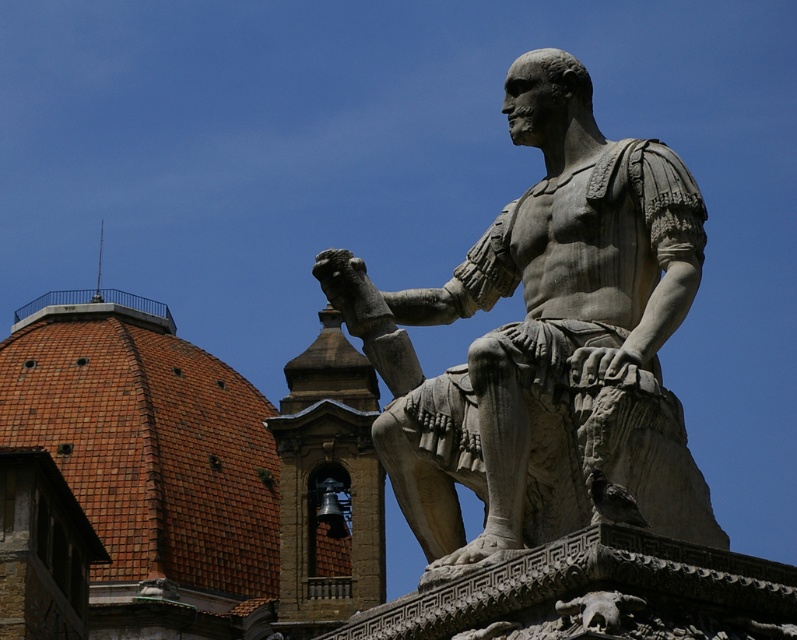
Consider the image. Can you confirm if gray stone statue at center is thinner than bronze bell at center?

No, gray stone statue at center is not thinner than bronze bell at center.

Which of these two, gray stone statue at center or bronze bell at center, stands shorter?

gray stone statue at center

Where is `gray stone statue at center`? Image resolution: width=797 pixels, height=640 pixels. gray stone statue at center is located at coordinates (548, 344).

Locate an element on the screen. gray stone statue at center is located at coordinates (548, 344).